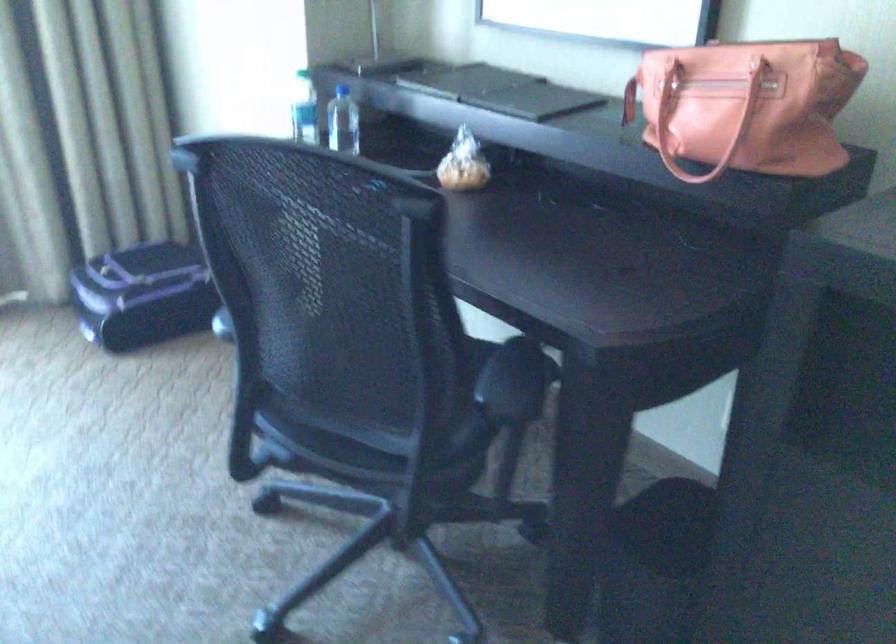
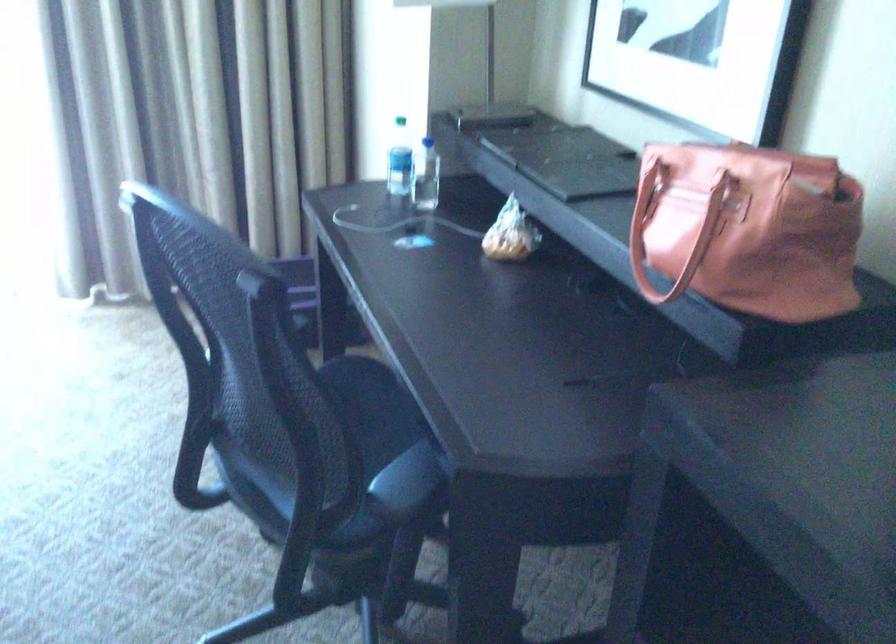
Question: The first image is from the beginning of the video and the second image is from the end. How did the camera likely rotate when shooting the video?

Choices:
 (A) Left
 (B) Right
 (C) Up
 (D) Down

Answer: (A)